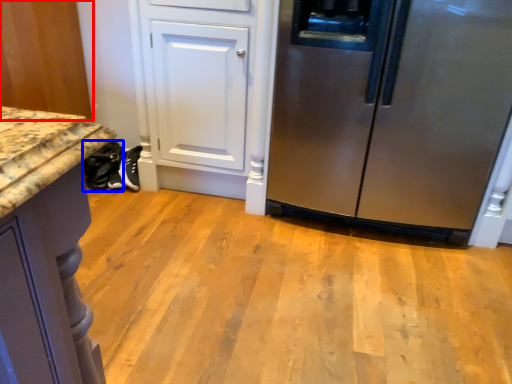
Question: Which object is further to the camera taking this photo, cabinetry (highlighted by a red box) or footwear (highlighted by a blue box)?

Choices:
 (A) cabinetry
 (B) footwear

Answer: (B)